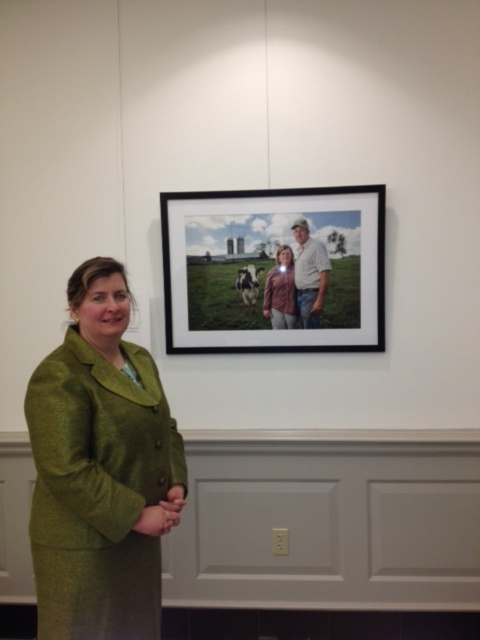
You are an interior designer arranging a display of clothing items. You have a white cotton shirt at upper center and a matte pink shirt at center. Which shirt should you place closer to the front of the display to maintain the original composition?

The white cotton shirt at upper center should be placed closer to the front of the display because it is closer to the viewer than the matte pink shirt at center in the original image.

You are a interior designer planning to hang a new painting that is 1 meter tall. You see the matte black frame at upper center and the matte pink shirt at center in the room. Can the new painting fit vertically between these two objects without overlapping them?

The matte black frame at upper center is taller than the matte pink shirt at center. Since the new painting is 1 meter tall, you need to measure the vertical space between them. However, without knowing the exact distance between the two objects, it is impossible to determine if the painting will fit. Please check the actual spacing between the matte black frame at upper center and the matte pink shirt at center.